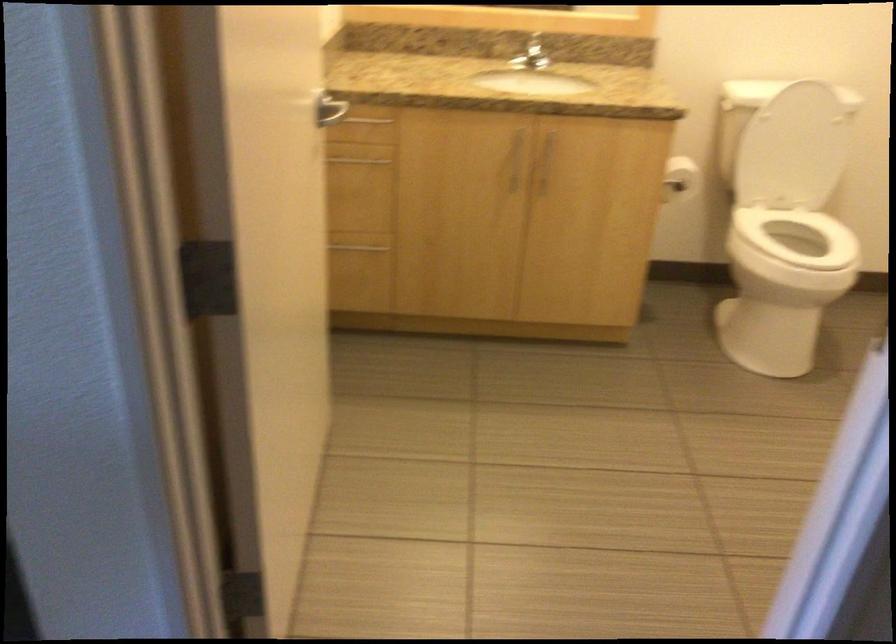
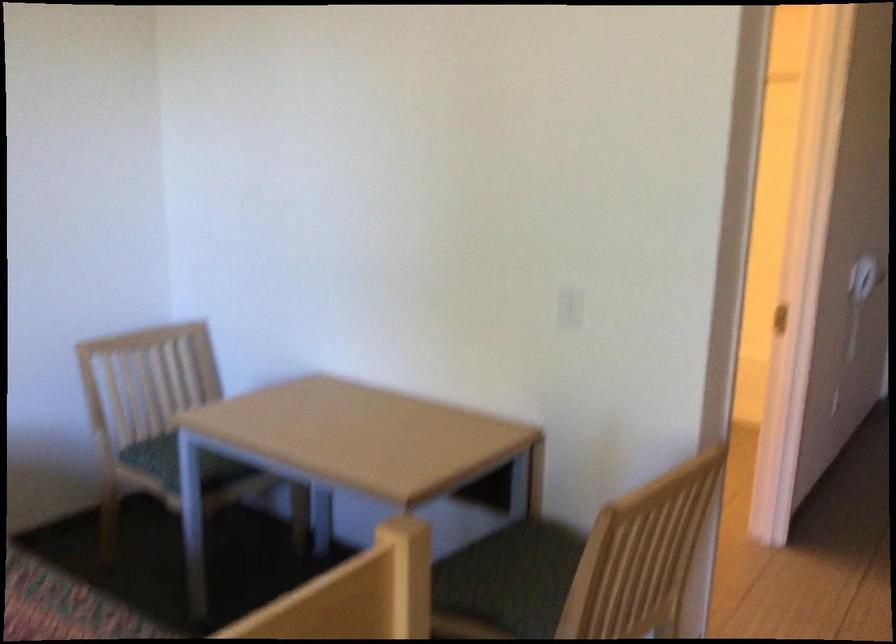
Question: I am providing you with two images of the same scene from different viewpoints. After the viewpoint changes to image2, which objects are now occluded?

Choices:
 (A) chair sitting surface
 (B) long handled mop
 (C) white electrical outlet
 (D) door handle

Answer: (D)